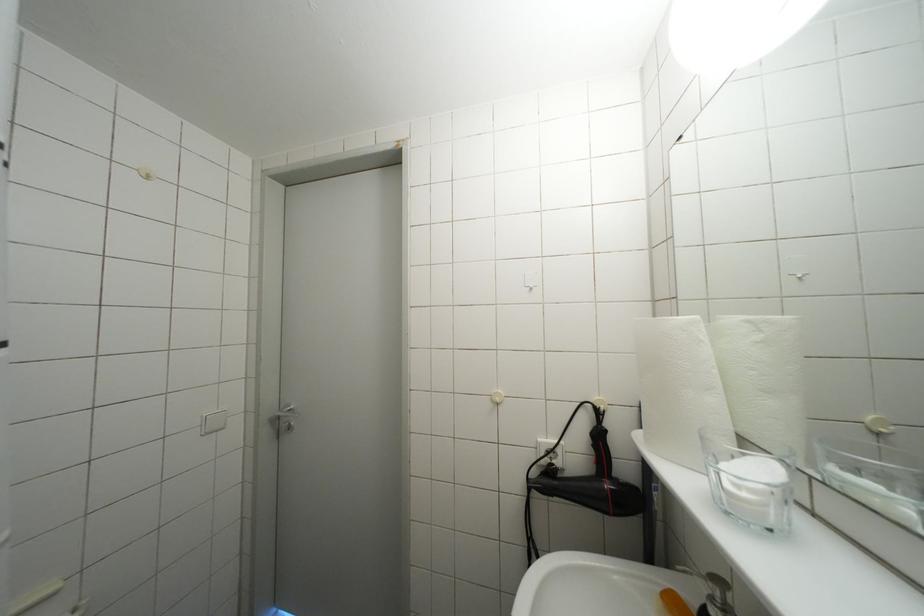
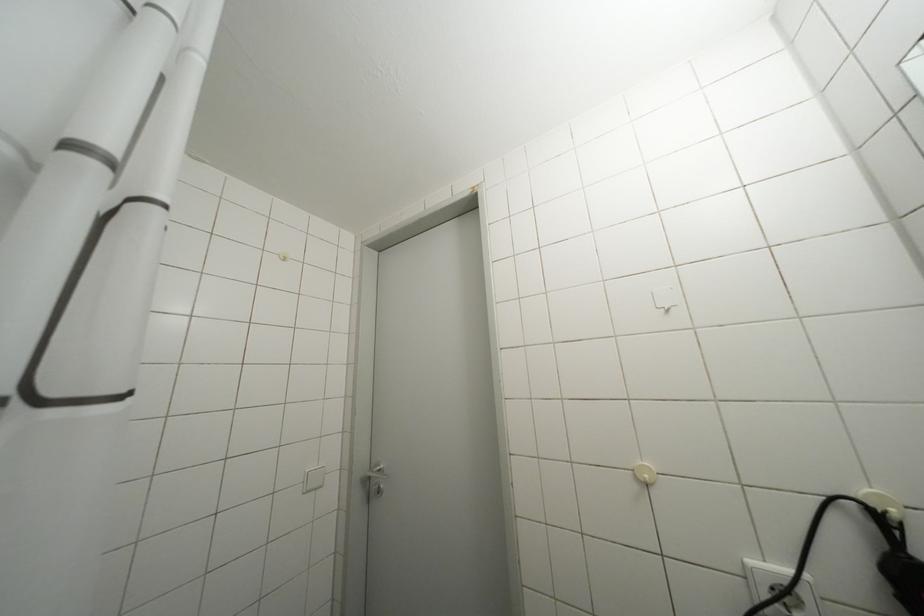
Question: How did the camera likely rotate?

Choices:
 (A) Left
 (B) Right
 (C) Up
 (D) Down

Answer: (A)